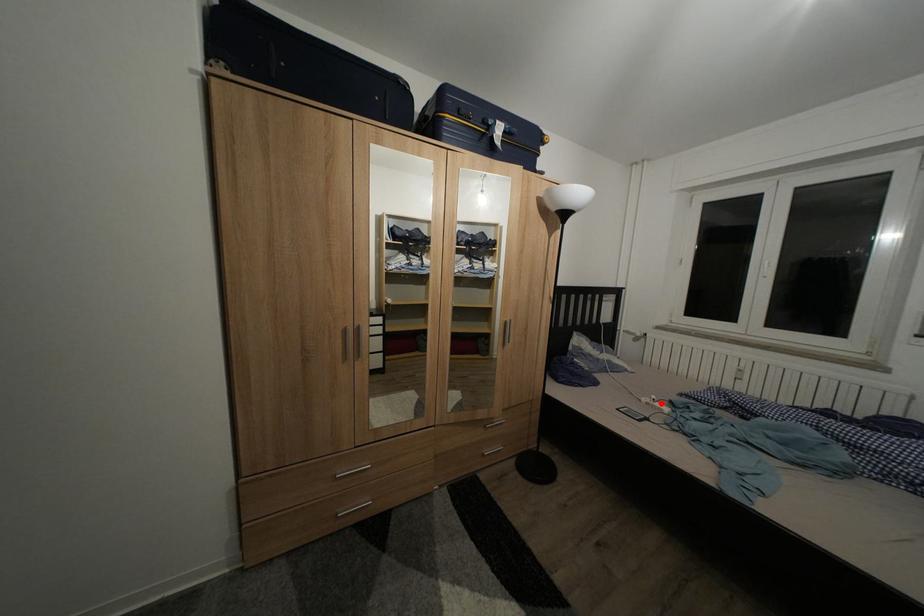
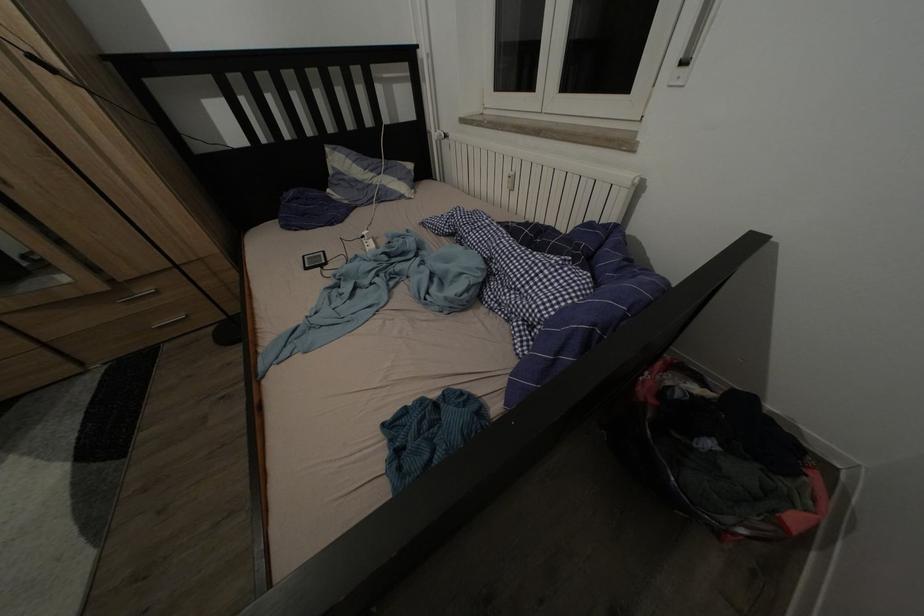
Question: I am providing you with two images of the same scene from different viewpoints. A red point is shown in image1. For the corresponding object point in image2, is it positioned nearer or farther from the camera?

Choices:
 (A) Nearer
 (B) Farther

Answer: (B)